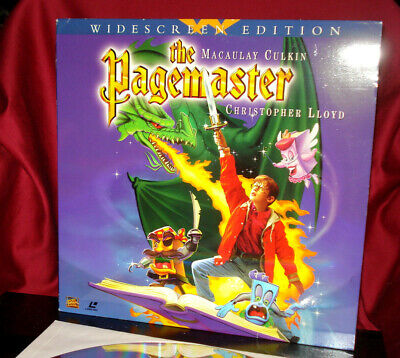
Identify the location of cover. click(212, 289).